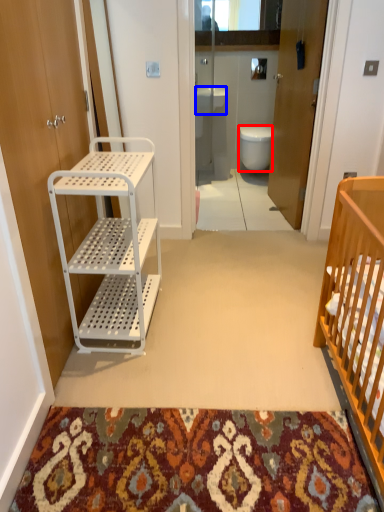
Question: Which of the following is the closest to the observer, toilet (highlighted by a red box) or sink (highlighted by a blue box)?

Choices:
 (A) toilet
 (B) sink

Answer: (B)